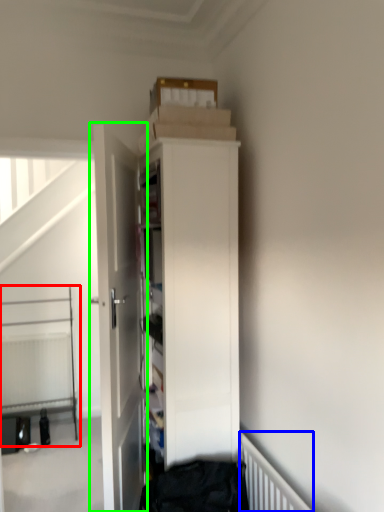
Question: Based on their relative distances, which object is farther from bed (highlighted by a red box)? Choose from radiator (highlighted by a blue box) and door (highlighted by a green box).

Choices:
 (A) radiator
 (B) door

Answer: (A)